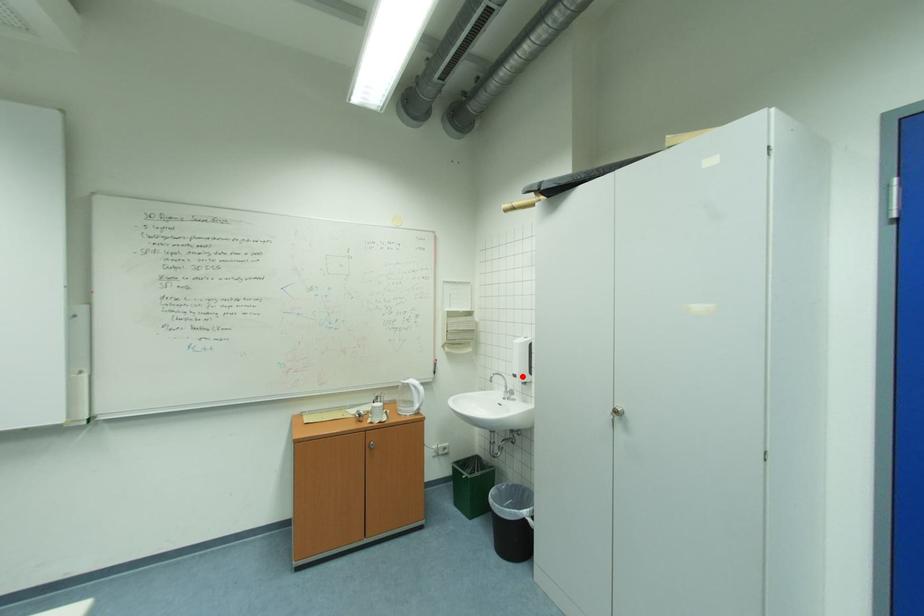
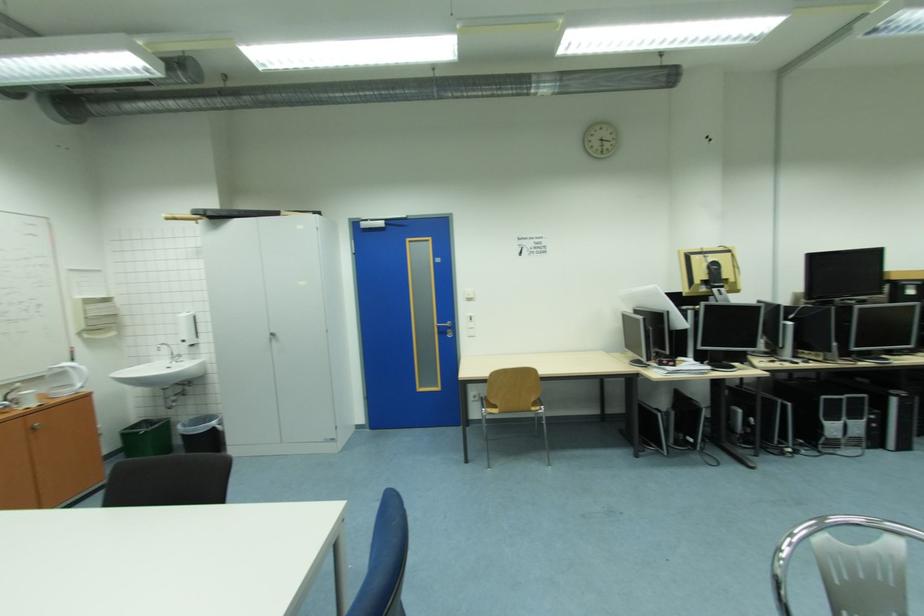
In the second image, find the point that corresponds to the highlighted location in the first image.

(189, 342)